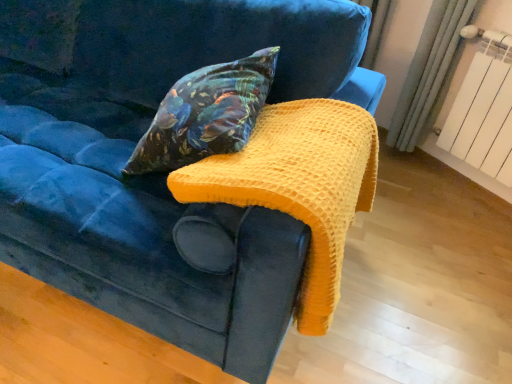
Question: From a real-world perspective, is velvet floral pillow at center under yellow waffle knit blanket at upper center?

Choices:
 (A) no
 (B) yes

Answer: (A)

Question: From the image's perspective, would you say velvet floral pillow at center is positioned over yellow waffle knit blanket at upper center?

Choices:
 (A) no
 (B) yes

Answer: (B)

Question: Does velvet floral pillow at center have a lesser width compared to yellow waffle knit blanket at upper center?

Choices:
 (A) yes
 (B) no

Answer: (A)

Question: Considering the relative sizes of velvet floral pillow at center and yellow waffle knit blanket at upper center in the image provided, is velvet floral pillow at center shorter than yellow waffle knit blanket at upper center?

Choices:
 (A) no
 (B) yes

Answer: (B)

Question: Is yellow waffle knit blanket at upper center surrounded by velvet floral pillow at center?

Choices:
 (A) no
 (B) yes

Answer: (A)

Question: Would you say yellow waffle knit blanket at upper center is to the left or to the right of velvet floral pillow at center in the picture?

Choices:
 (A) left
 (B) right

Answer: (B)

Question: Looking at the image, does yellow waffle knit blanket at upper center seem bigger or smaller compared to velvet floral pillow at center?

Choices:
 (A) big
 (B) small

Answer: (A)

Question: In terms of width, does yellow waffle knit blanket at upper center look wider or thinner when compared to velvet floral pillow at center?

Choices:
 (A) wide
 (B) thin

Answer: (A)

Question: Is point (328, 261) positioned closer to the camera than point (173, 96)?

Choices:
 (A) farther
 (B) closer

Answer: (B)

Question: From a real-world perspective, is white painted metal radiator at upper right physically located above or below velvet floral pillow at center?

Choices:
 (A) below
 (B) above

Answer: (A)

Question: Is white painted metal radiator at upper right spatially inside velvet floral pillow at center, or outside of it?

Choices:
 (A) inside
 (B) outside

Answer: (B)

Question: In terms of width, does white painted metal radiator at upper right look wider or thinner when compared to velvet floral pillow at center?

Choices:
 (A) wide
 (B) thin

Answer: (B)

Question: Considering their positions, is white painted metal radiator at upper right located in front of or behind velvet floral pillow at center?

Choices:
 (A) behind
 (B) front

Answer: (A)

Question: Is yellow waffle knit blanket at upper center in front of or behind white painted metal radiator at upper right in the image?

Choices:
 (A) front
 (B) behind

Answer: (A)

Question: Looking at the image, does yellow waffle knit blanket at upper center seem bigger or smaller compared to white painted metal radiator at upper right?

Choices:
 (A) small
 (B) big

Answer: (B)